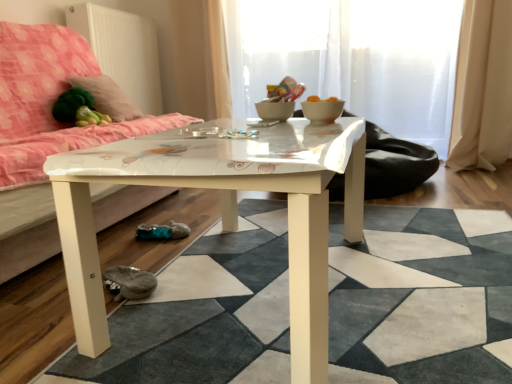
Where is `vacant space behind gray suede shoe at lower left`? vacant space behind gray suede shoe at lower left is located at coordinates (155, 260).